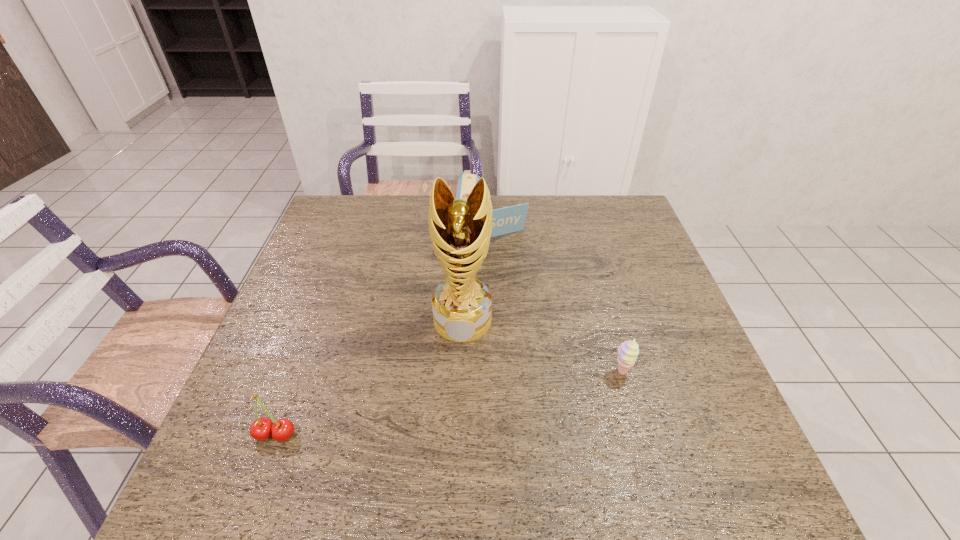
The width and height of the screenshot is (960, 540). I want to click on vacant region at the near edge of the desktop, so coord(396,407).

I want to click on vacant point at the left edge, so click(x=286, y=383).

This screenshot has height=540, width=960. What are the coordinates of `vacant area at the right edge` in the screenshot? It's located at (652, 302).

In the image, there is a desktop. Identify the location of vacant space at the far right corner. (602, 205).

Locate an element on the screen. The height and width of the screenshot is (540, 960). free space at the near right corner of the desktop is located at coordinates (728, 410).

In order to click on blank region between the third farthest object and the award in this screenshot , I will do `click(542, 346)`.

This screenshot has height=540, width=960. What are the coordinates of `blank region between the rightmost object and the award` in the screenshot? It's located at (542, 346).

I want to click on free space between the cherry and the award, so click(369, 377).

Locate an element on the screen. This screenshot has height=540, width=960. blank region between the nearest object and the rightmost object is located at coordinates (448, 403).

This screenshot has height=540, width=960. I want to click on free space between the tallest object and the farthest object, so click(477, 276).